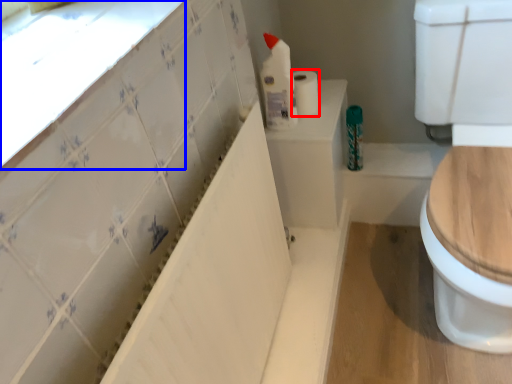
Question: Among these objects, which one is farthest to the camera, toilet paper (highlighted by a red box) or window sill (highlighted by a blue box)?

Choices:
 (A) toilet paper
 (B) window sill

Answer: (A)